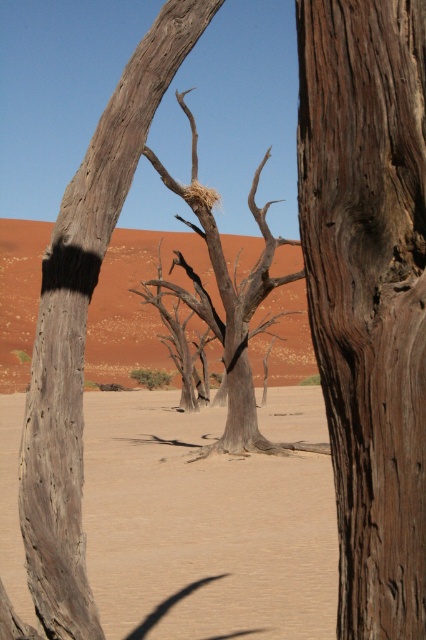
You are an explorer in the desert and need to find shelter. You see a dark brown wood at center and a sandy beige desert at center. Which one is smaller in size and could potentially be used as a makeshift shelter?

The dark brown wood at center has a smaller size compared to the sandy beige desert at center, so it could potentially be used as a makeshift shelter.

You are standing in the desert scene and want to place a small flag at each of the two points labeled point (412, 433) and point (328, 484). Which point will your flag be closer to you when planted?

The flag placed at point (412, 433) will be closer to you because it is closer to the viewer than point (328, 484) according to the description.